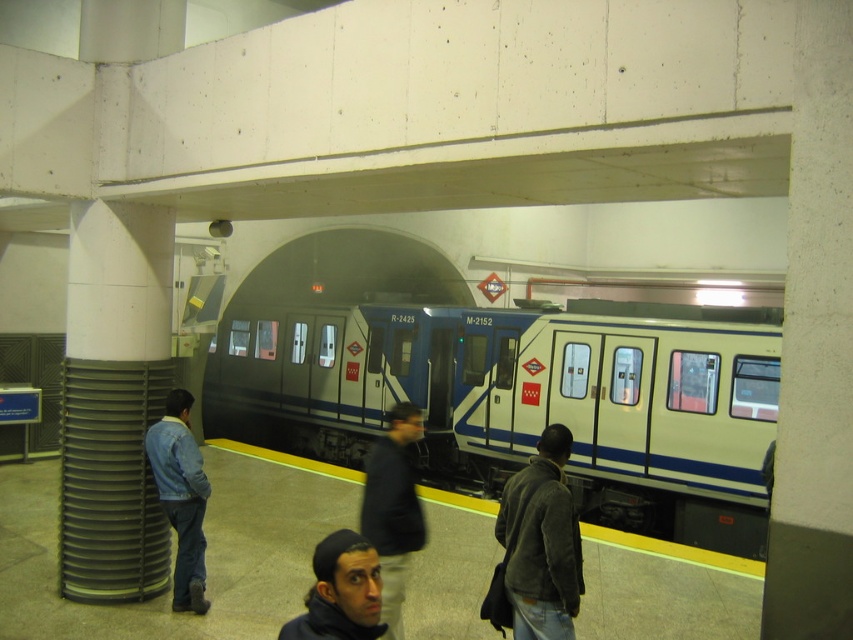
You are waiting on the subway platform and see the dark brown fuzzy jacket at center and the dark blue knit cap at lower center. Which one is closer to you?

The dark brown fuzzy jacket at center is closer to you because it is further to the viewer than the dark blue knit cap at lower center.

You are standing on the subway platform and want to take a photo of both point (273, 337) and point (170, 422) in the image. Which point should you focus on first to ensure both are in focus?

You should focus on point (273, 337) first because it is closer to the camera than point (170, 422), ensuring both will be in focus when using depth of field.